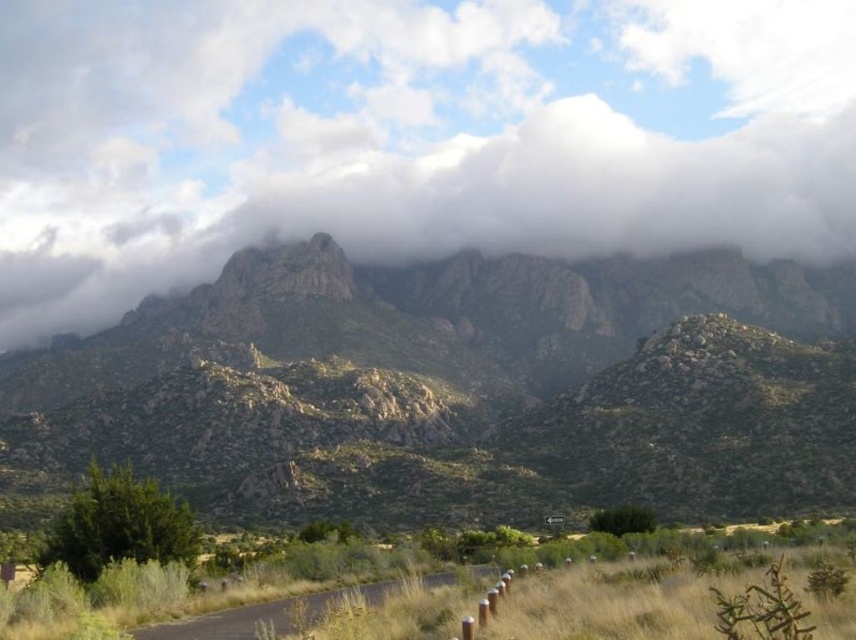
Question: Can you confirm if white fluffy cloud at upper center is thinner than rocky mountain range at upper center?

Choices:
 (A) no
 (B) yes

Answer: (A)

Question: In this image, where is white fluffy cloud at upper center located relative to rocky mountain range at upper center?

Choices:
 (A) left
 (B) right

Answer: (B)

Question: Is white fluffy cloud at upper center above rocky mountain range at upper center?

Choices:
 (A) yes
 (B) no

Answer: (A)

Question: Which object is farther from the camera taking this photo?

Choices:
 (A) rocky mountain range at upper center
 (B) white fluffy cloud at upper center

Answer: (B)

Question: Among these points, which one is nearest to the camera?

Choices:
 (A) (331, 45)
 (B) (592, 260)

Answer: (B)